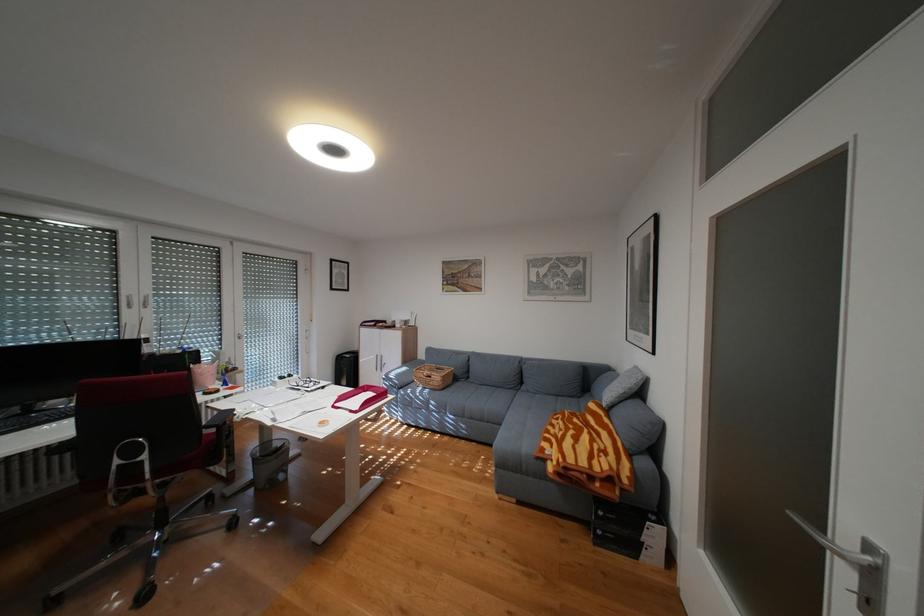
This screenshot has height=616, width=924. What do you see at coordinates (833, 544) in the screenshot?
I see `the silver door handle` at bounding box center [833, 544].